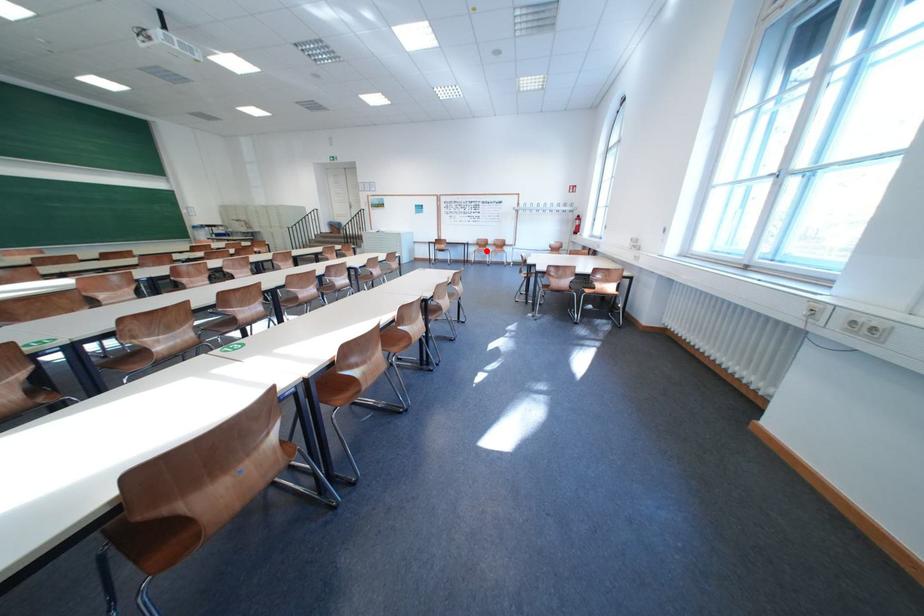
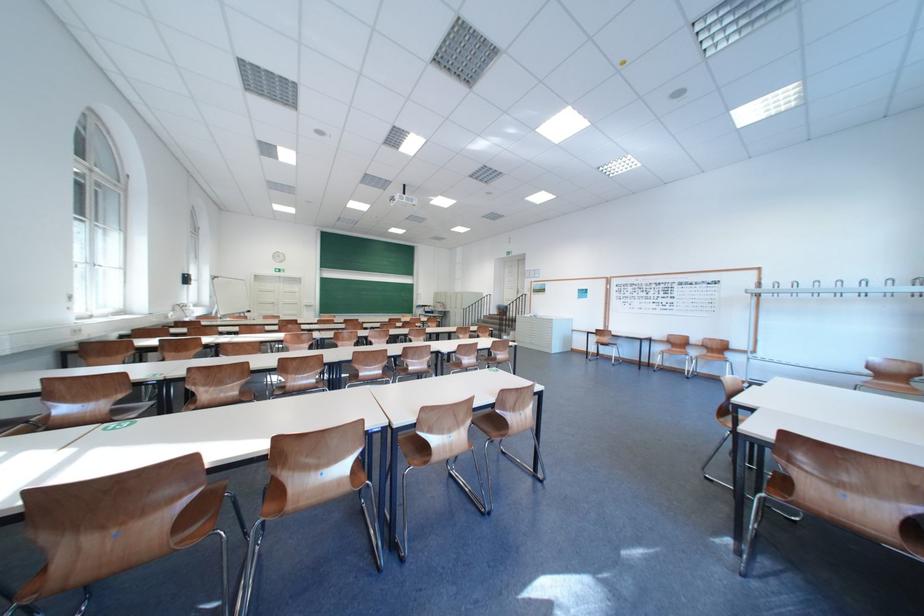
Question: I am providing you with two images of the same scene from different viewpoints. Image1 has a red point marked. In image2, the corresponding 3D location appears at what relative position? Reply with the corresponding letter.

Choices:
 (A) Closer
 (B) Farther

Answer: (B)